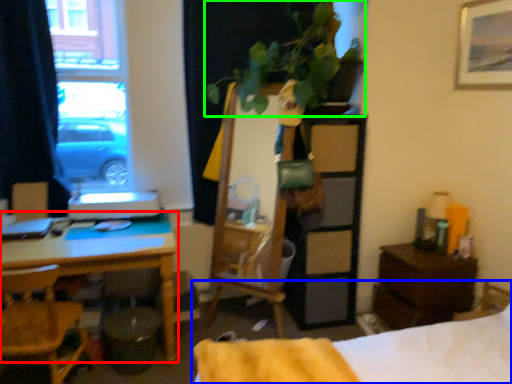
Question: Which object is the farthest from desk (highlighted by a red box)? Choose among these: bed (highlighted by a blue box) or houseplant (highlighted by a green box).

Choices:
 (A) bed
 (B) houseplant

Answer: (B)